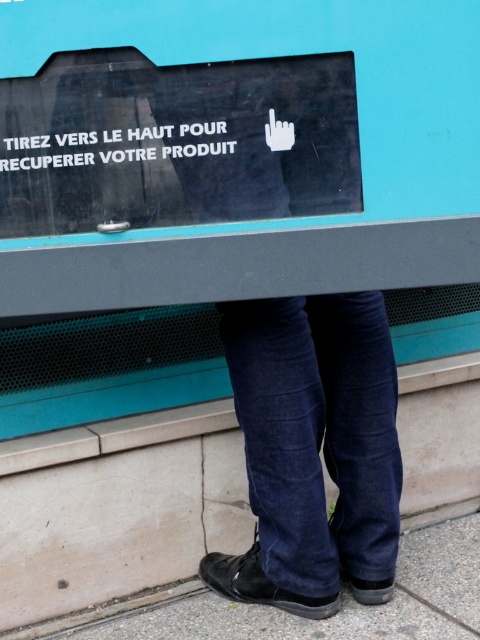
Question: Which point is closer to the camera?

Choices:
 (A) (352, 170)
 (B) (338, 566)

Answer: (A)

Question: Is black glossy sign at upper center above denim jeans at lower center?

Choices:
 (A) no
 (B) yes

Answer: (B)

Question: Is black glossy sign at upper center wider than denim jeans at lower center?

Choices:
 (A) no
 (B) yes

Answer: (B)

Question: Is black glossy sign at upper center to the left of denim jeans at lower center from the viewer's perspective?

Choices:
 (A) yes
 (B) no

Answer: (A)